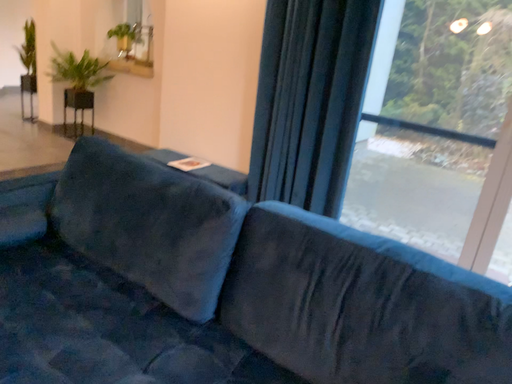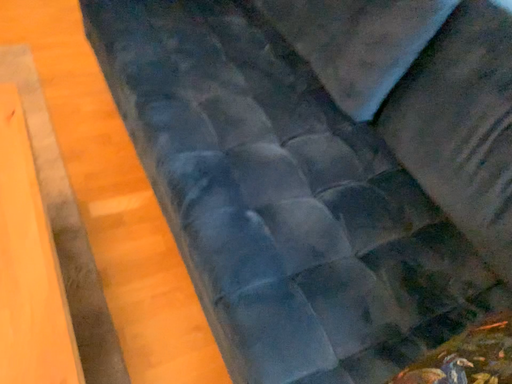
Question: Which way did the camera rotate in the video?

Choices:
 (A) rotated right
 (B) rotated left

Answer: (B)